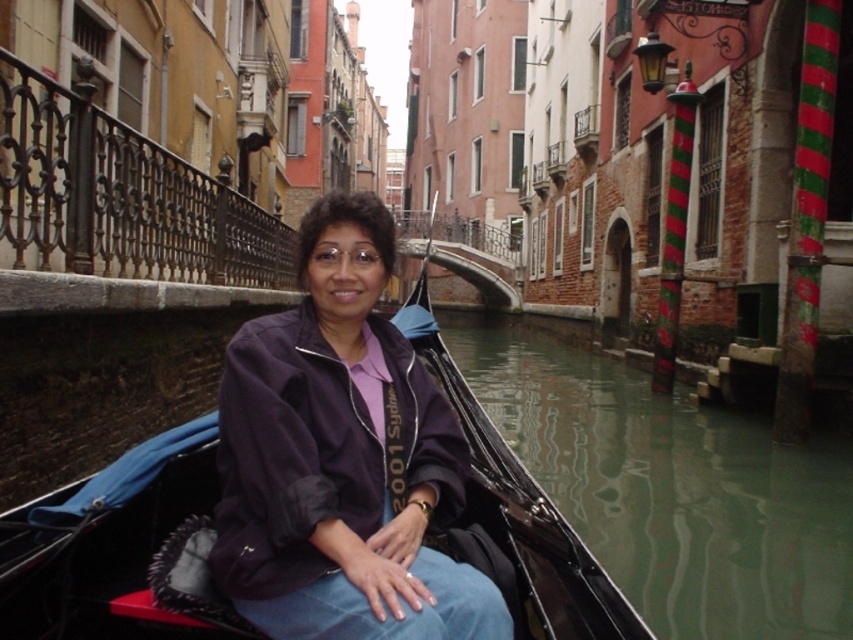
Question: Which is nearer to the dark purple jacket at center?

Choices:
 (A) green reflective water at lower center
 (B) black leather boat at center

Answer: (B)

Question: Does dark purple jacket at center lie in front of black leather boat at center?

Choices:
 (A) no
 (B) yes

Answer: (A)

Question: Is green reflective water at lower center bigger than black leather boat at center?

Choices:
 (A) no
 (B) yes

Answer: (B)

Question: Which of the following is the farthest from the observer?

Choices:
 (A) (196, 636)
 (B) (252, 385)

Answer: (B)

Question: Can you confirm if dark purple jacket at center is positioned to the left of green reflective water at lower center?

Choices:
 (A) no
 (B) yes

Answer: (B)

Question: Which object is the closest to the green reflective water at lower center?

Choices:
 (A) black leather boat at center
 (B) dark purple jacket at center

Answer: (A)